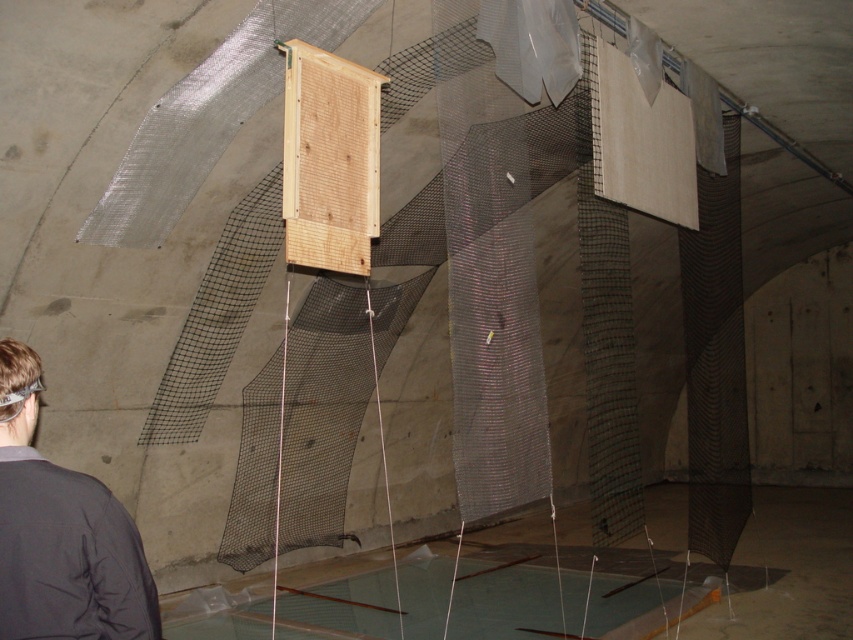
Can you confirm if dark gray jacket at lower left is positioned below clear plastic goggles at lower left?

Indeed, dark gray jacket at lower left is positioned under clear plastic goggles at lower left.

Does point (0, 451) come in front of point (4, 420)?

Yes, point (0, 451) is in front of point (4, 420).

Image resolution: width=853 pixels, height=640 pixels. What are the coordinates of `dark gray jacket at lower left` in the screenshot? It's located at (65, 548).